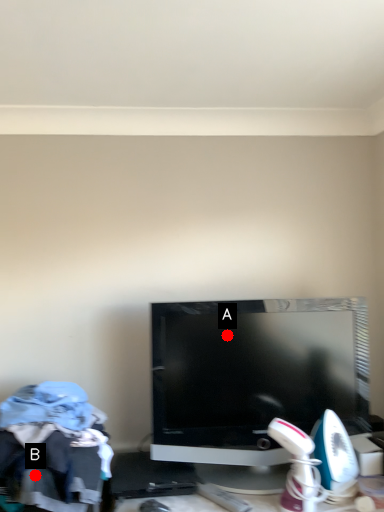
Question: Two points are circled on the image, labeled by A and B beside each circle. Which point is closer to the camera taking this photo?

Choices:
 (A) A is closer
 (B) B is closer

Answer: (B)